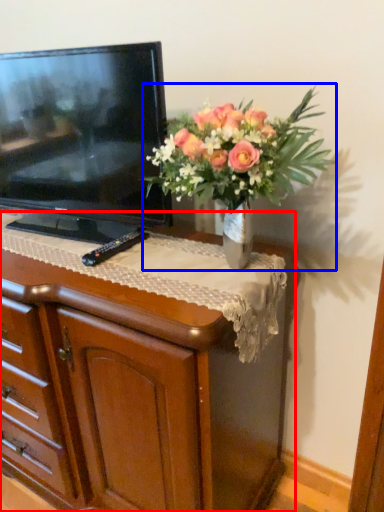
Question: Which point is closer to the camera, chest of drawers (highlighted by a red box) or houseplant (highlighted by a blue box)?

Choices:
 (A) chest of drawers
 (B) houseplant

Answer: (B)